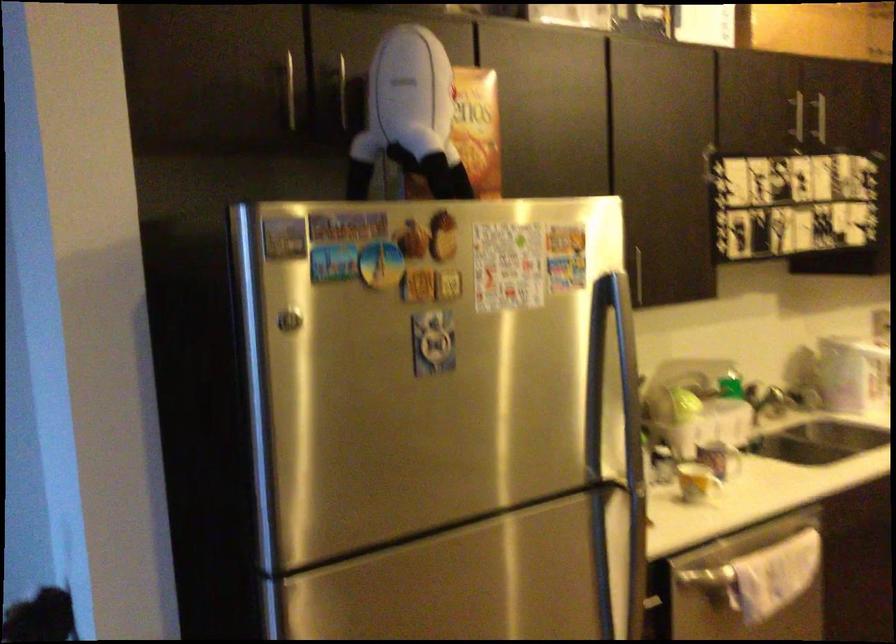
Where is `dishwasher handle`? The height and width of the screenshot is (644, 896). dishwasher handle is located at coordinates (752, 594).